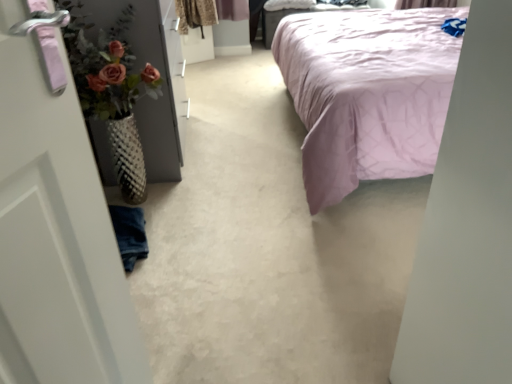
The width and height of the screenshot is (512, 384). Describe the element at coordinates (367, 93) in the screenshot. I see `pink satin bed at center` at that location.

Locate an element on the screen. pink satin bed at center is located at coordinates (367, 93).

Locate an element on the screen. This screenshot has height=384, width=512. pink satin bed at center is located at coordinates (367, 93).